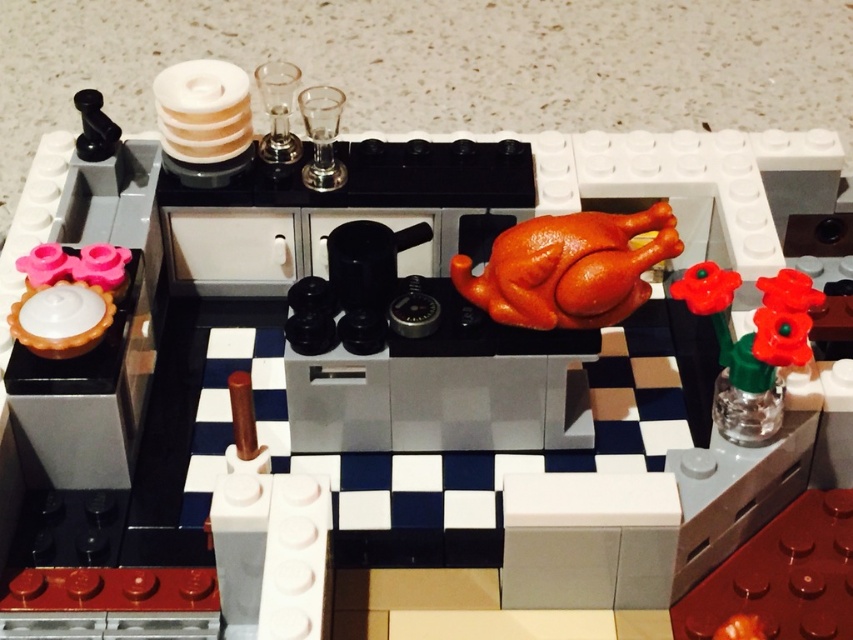
Is shiny orange turkey at center smaller than translucent green glass vase at right?

Indeed, shiny orange turkey at center has a smaller size compared to translucent green glass vase at right.

Can you confirm if shiny orange turkey at center is positioned above translucent green glass vase at right?

Yes.

Where is `shiny orange turkey at center`? shiny orange turkey at center is located at coordinates (567, 268).

The height and width of the screenshot is (640, 853). In order to click on shiny orange turkey at center in this screenshot , I will do `click(567, 268)`.